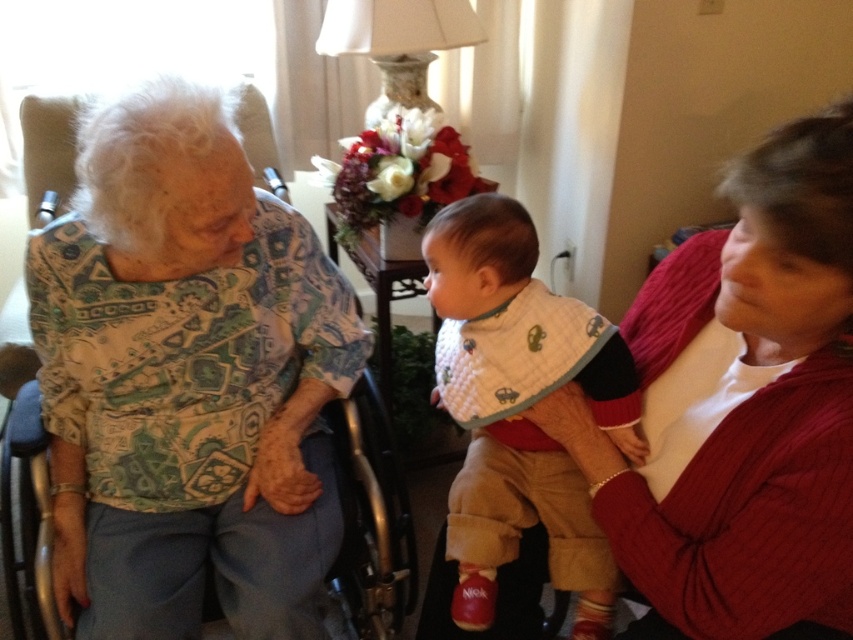
Question: Which point is closer to the camera taking this photo?

Choices:
 (A) (438, 237)
 (B) (633, 570)
 (C) (322, 291)

Answer: (B)

Question: Among these objects, which one is nearest to the camera?

Choices:
 (A) white quilted bib at center
 (B) matte red sweater at right

Answer: (B)

Question: Can you confirm if matte red sweater at right is positioned to the left of silver metallic wheelchair at left?

Choices:
 (A) no
 (B) yes

Answer: (A)

Question: Can you confirm if matte red sweater at right is positioned to the right of white quilted bib at center?

Choices:
 (A) yes
 (B) no

Answer: (A)

Question: Is matte red sweater at right thinner than silver metallic wheelchair at left?

Choices:
 (A) yes
 (B) no

Answer: (A)

Question: Which point is farther from the camera taking this photo?

Choices:
 (A) (610, 564)
 (B) (35, 433)

Answer: (B)